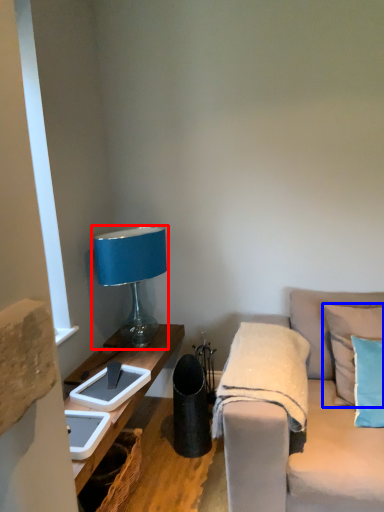
Question: Which point is closer to the camera, lamp (highlighted by a red box) or pillow (highlighted by a blue box)?

Choices:
 (A) lamp
 (B) pillow

Answer: (B)